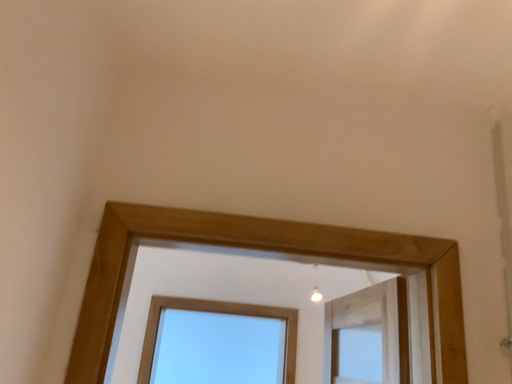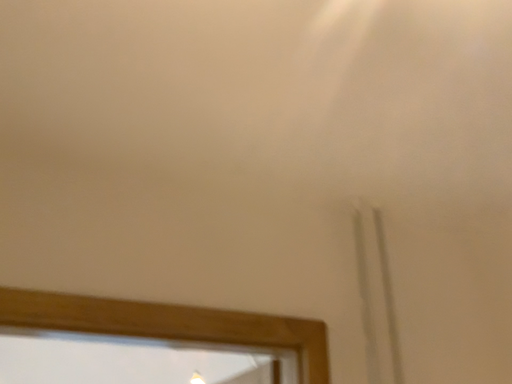
Question: How did the camera likely rotate when shooting the video?

Choices:
 (A) rotated right
 (B) rotated left

Answer: (A)